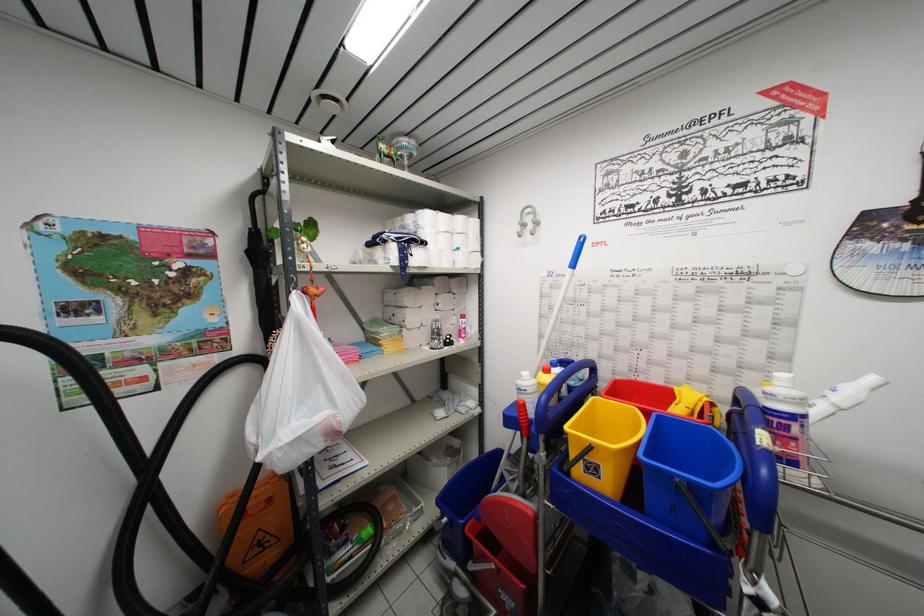
At what (x,y) coordinates should I click in order to perform the action: click on white mop handle. Please return your answer as a coordinate pair (x, y). The height and width of the screenshot is (616, 924). Looking at the image, I should click on (577, 251).